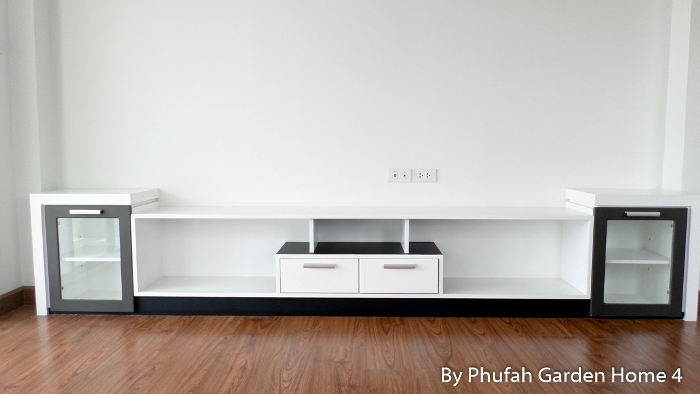
Identify the location of glass. (85, 252).